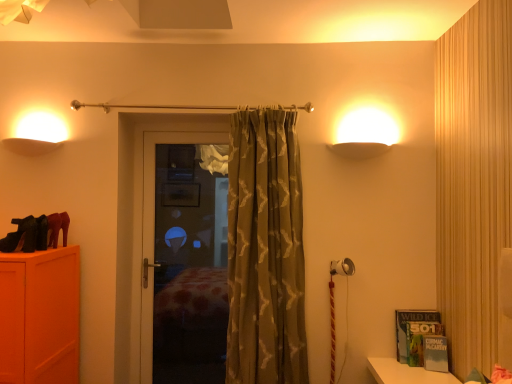
Locate an element on the screen. green textured curtain at center is located at coordinates (265, 251).

What do you see at coordinates (265, 251) in the screenshot? I see `green textured curtain at center` at bounding box center [265, 251].

The width and height of the screenshot is (512, 384). Find the location of `green textured curtain at center`. green textured curtain at center is located at coordinates (265, 251).